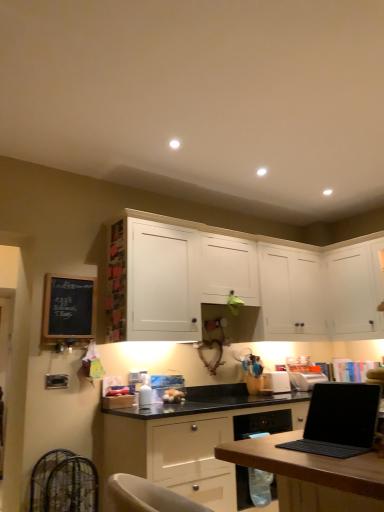
Question: Is black chalkboard at left situated inside black matte laptop at lower right or outside?

Choices:
 (A) outside
 (B) inside

Answer: (A)

Question: In terms of height, does black chalkboard at left look taller or shorter compared to black matte laptop at lower right?

Choices:
 (A) tall
 (B) short

Answer: (A)

Question: Which of these objects is positioned closest to the black matte laptop at lower right?

Choices:
 (A) matte white cabinet at center, acting as the 3th cabinetry starting from the top
 (B) white matte cabinet at upper right, placed as the 2th cabinetry when sorted from bottom to top
 (C) white matte cabinet at center, the third cabinetry from the bottom
 (D) black chalkboard at left
 (E) wooden photo frame at upper center

Answer: (A)

Question: Estimate the real-world distances between objects in this image. Which object is farther from the wooden photo frame at upper center?

Choices:
 (A) white plastic toaster at center
 (B) white matte cabinet at upper right, which is the 2th cabinetry in top-to-bottom order
 (C) black chalkboard at left
 (D) white matte cabinet at center, the third cabinetry from the bottom
 (E) black matte laptop at lower right

Answer: (B)